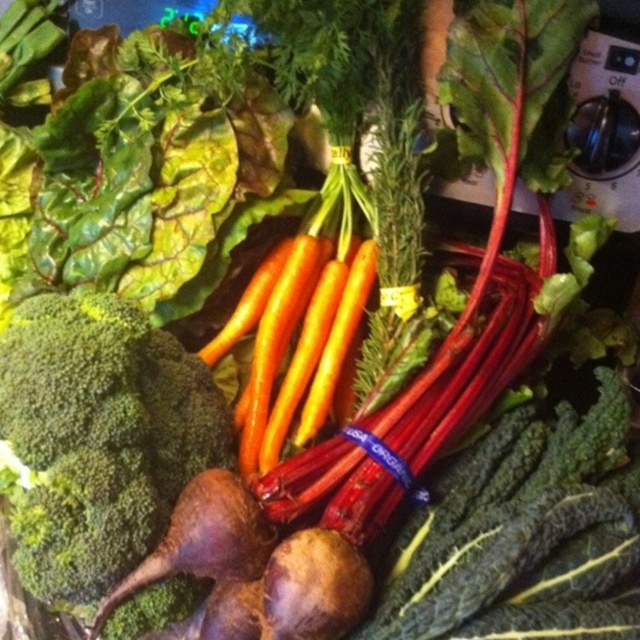
Question: Among these objects, which one is nearest to the camera?

Choices:
 (A) green matte broccoli at lower left
 (B) orange smooth carrot at center

Answer: (A)

Question: Which object is farther from the camera taking this photo?

Choices:
 (A) green matte broccoli at lower left
 (B) orange smooth carrot at center

Answer: (B)

Question: Can you confirm if green matte broccoli at lower left is smaller than orange smooth carrot at center?

Choices:
 (A) yes
 (B) no

Answer: (B)

Question: Which object appears farthest from the camera in this image?

Choices:
 (A) orange smooth carrot at center
 (B) green matte broccoli at lower left

Answer: (A)

Question: Can you confirm if green matte broccoli at lower left is smaller than orange smooth carrot at center?

Choices:
 (A) no
 (B) yes

Answer: (A)

Question: Considering the relative positions of green matte broccoli at lower left and orange smooth carrot at center in the image provided, where is green matte broccoli at lower left located with respect to orange smooth carrot at center?

Choices:
 (A) right
 (B) left

Answer: (B)